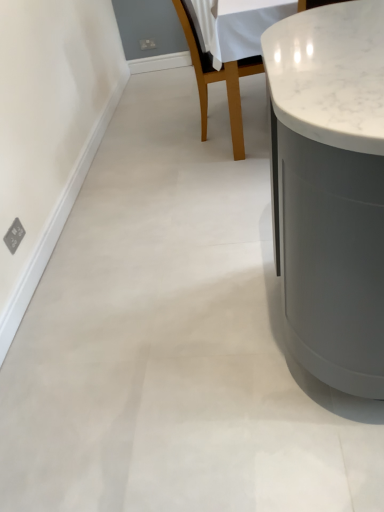
The height and width of the screenshot is (512, 384). Find the location of `vacant area in front of wooden chair at center`. vacant area in front of wooden chair at center is located at coordinates (223, 158).